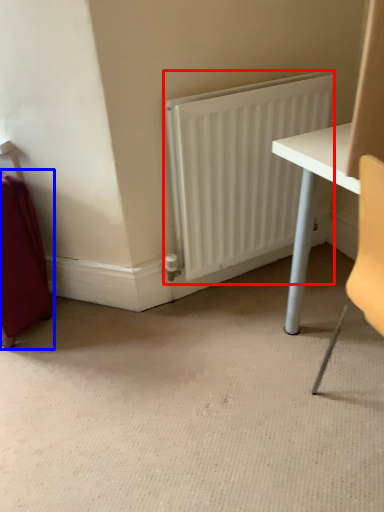
Question: Among these objects, which one is farthest to the camera, radiator (highlighted by a red box) or luggage (highlighted by a blue box)?

Choices:
 (A) radiator
 (B) luggage

Answer: (A)